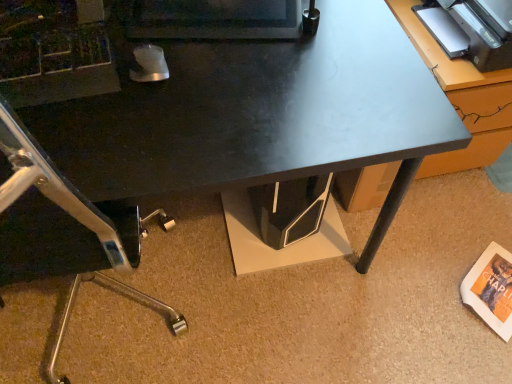
Question: Looking at their shapes, would you say matte black monitor at upper center is wider or thinner than metallic gray table at upper right?

Choices:
 (A) thin
 (B) wide

Answer: (A)

Question: Looking at the image, does matte black monitor at upper center seem bigger or smaller compared to metallic gray table at upper right?

Choices:
 (A) small
 (B) big

Answer: (A)

Question: Which is nearer to the black glossy desk at center?

Choices:
 (A) matte black monitor at upper center
 (B) metallic gray table at upper right

Answer: (A)

Question: Estimate the real-world distances between objects in this image. Which object is farther from the metallic gray table at upper right?

Choices:
 (A) black glossy desk at center
 (B) matte black monitor at upper center

Answer: (B)